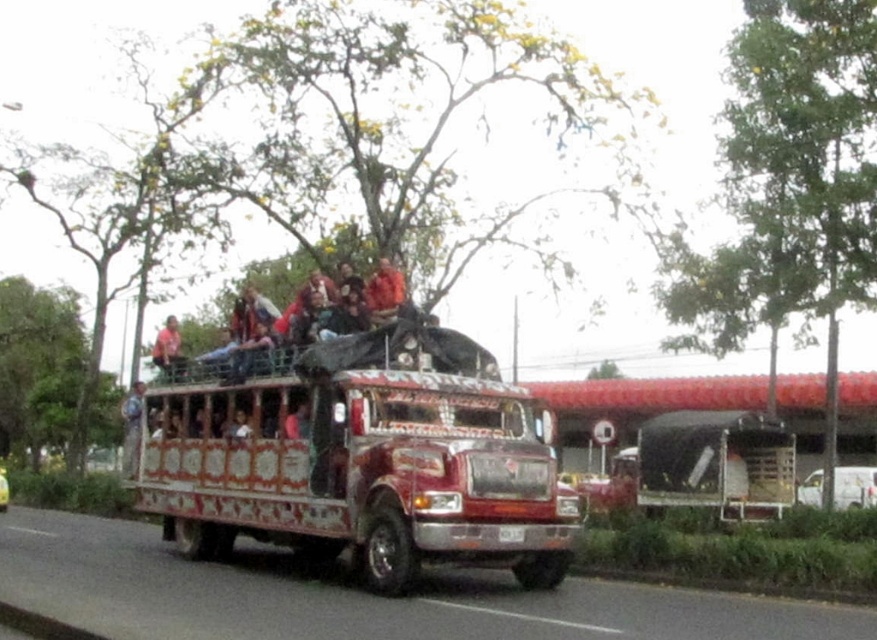
You are a passenger on the decorative painted bus at center and want to find the matte pink shirt at center from your seat. Which direction should you look to locate it?

The matte pink shirt at center is to the left of the decorative painted bus at center, so you should look to your left to locate it.

From the picture: You are a pedestrian standing on the sidewalk and see the decorative painted bus at center and the matte pink shirt at center in the image. Which object is closer to the ground?

The decorative painted bus at center is closer to the ground because it is below the matte pink shirt at center.

Based on the photo, you are a passenger on the large, red and white decorated bus and want to get off at the next stop. The driver tells you to exit through the door located at point (x=369, y=372). However, you notice another exit at point (x=170, y=333). Which exit is closer to you if you are standing at the back of the bus?

Point (x=369, y=372) is in front of point (x=170, y=333), so the exit at point (x=170, y=333) is closer to the back of the bus.